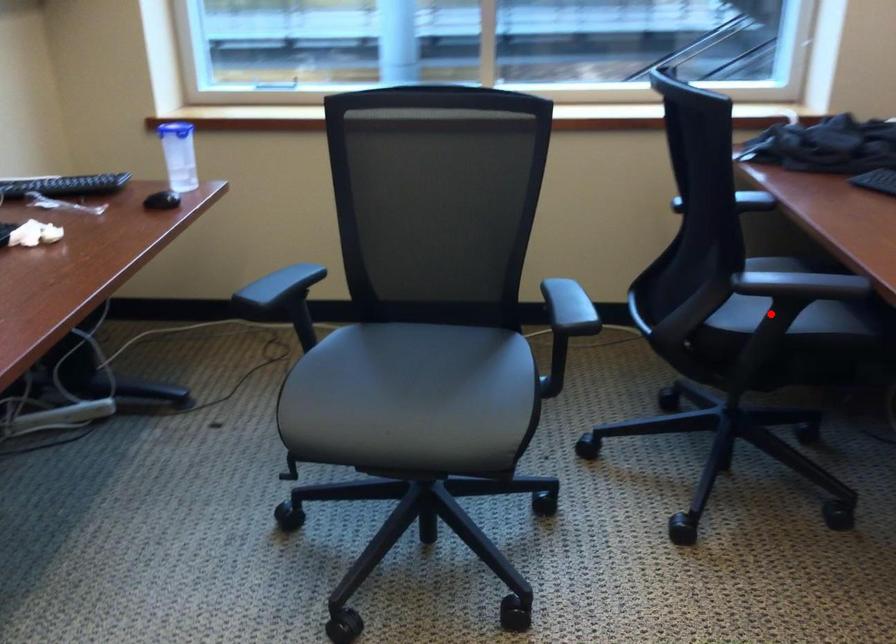
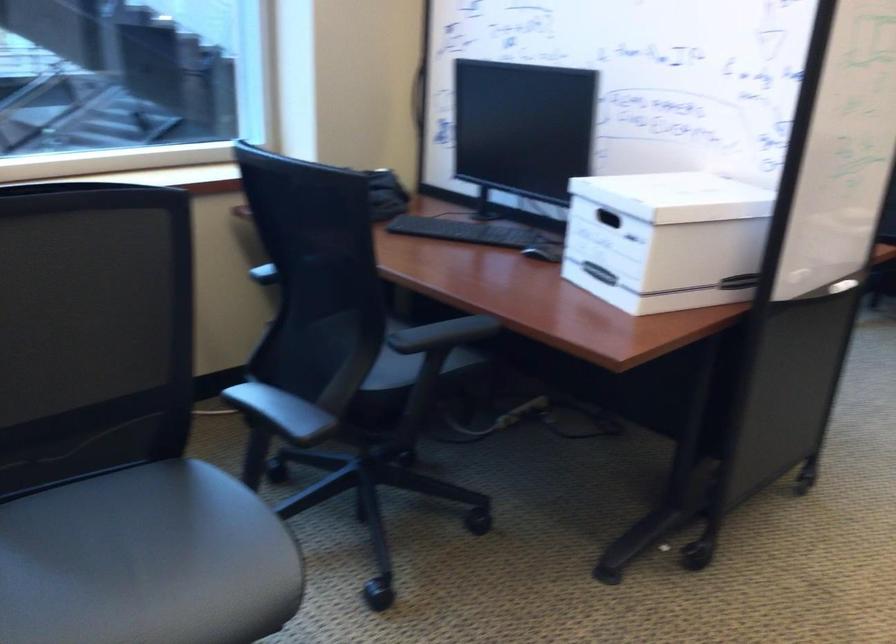
Question: I am providing you with two images of the same scene from different viewpoints. Image1 has a red point marked. In image2, the corresponding 3D location appears at what relative position? Reply with the corresponding letter.

Choices:
 (A) Closer
 (B) Farther

Answer: (B)